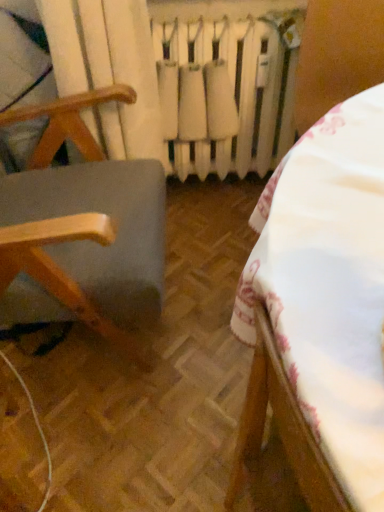
This screenshot has height=512, width=384. In order to click on free point above white matte radiator at center (from a real-world perspective) in this screenshot , I will do `click(228, 8)`.